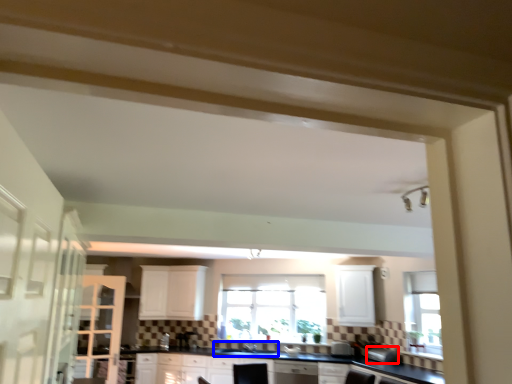
Question: Which object appears farthest to the camera in this image, appliance (highlighted by a red box) or sink (highlighted by a blue box)?

Choices:
 (A) appliance
 (B) sink

Answer: (B)